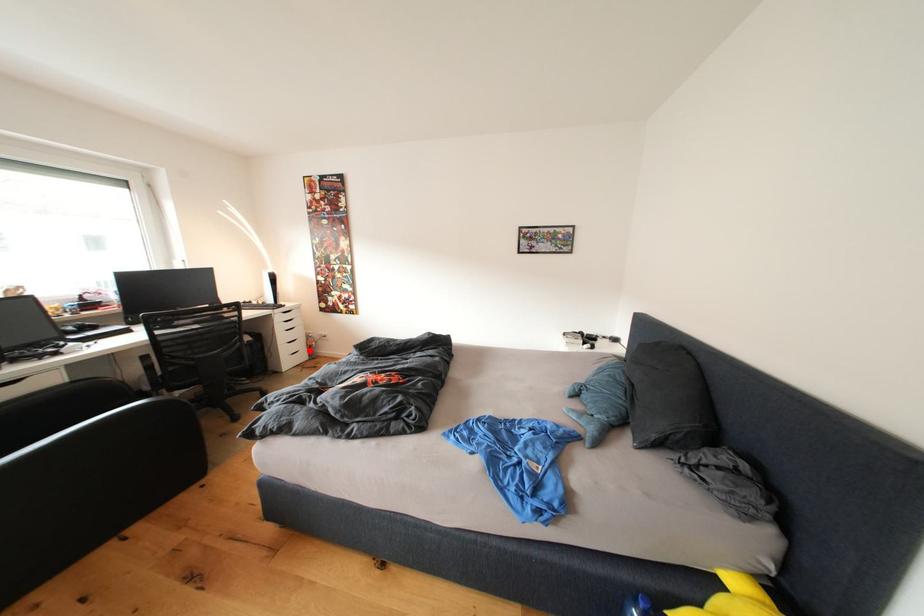
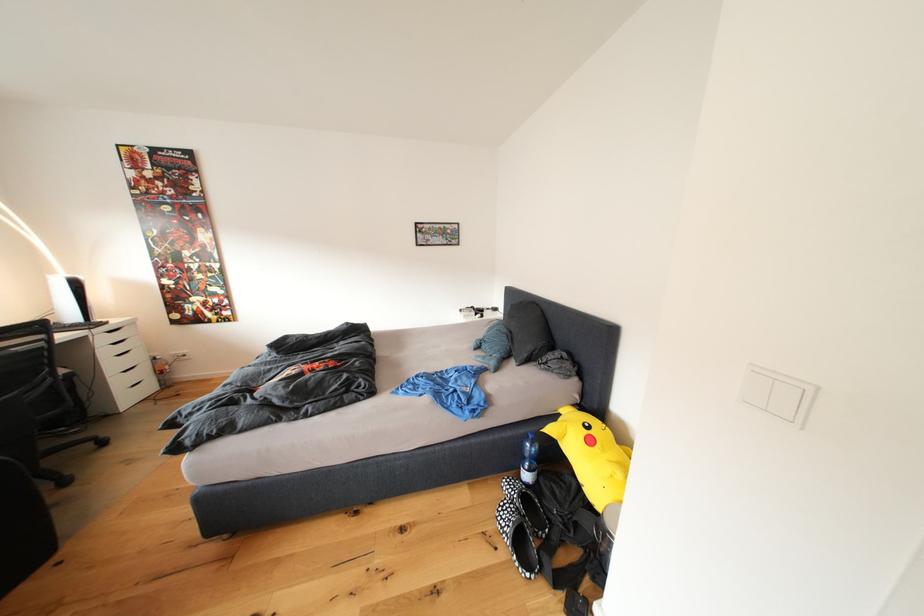
Find the pixel in the second image that matches the highlighted location in the first image.

(152, 379)